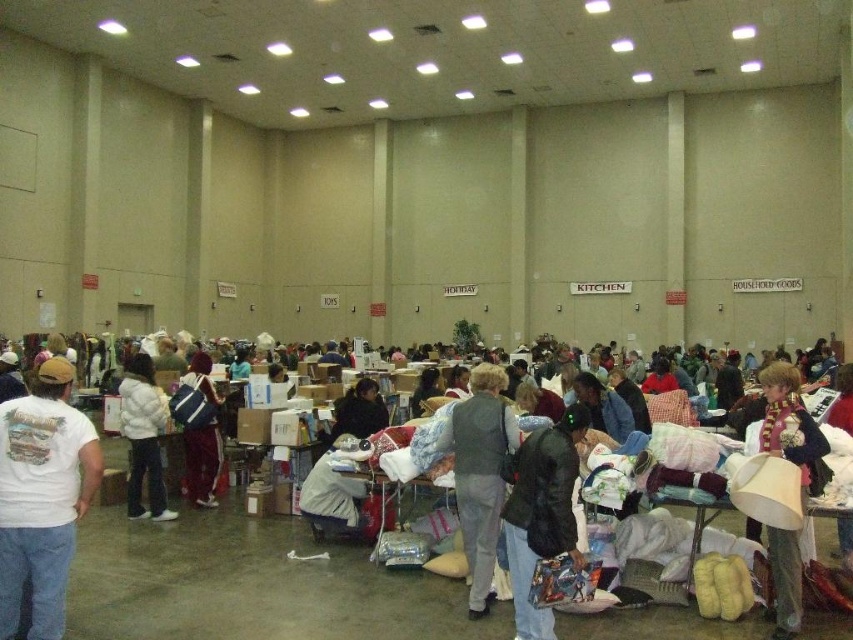
In the scene shown: Does gray fabric vest at center appear over velvet maroon scarf at lower right?

Actually, gray fabric vest at center is below velvet maroon scarf at lower right.

Who is shorter, gray fabric vest at center or velvet maroon scarf at lower right?

With less height is gray fabric vest at center.

Is point (462, 509) more distant than point (775, 412)?

Yes, it is behind point (775, 412).

You are a GUI agent. You are given a task and a screenshot of the screen. Output one action in this format:
    pyautogui.click(x=<x>, y=<y>)
    Task: Click on the gray fabric vest at center
    The width and height of the screenshot is (853, 640).
    Given the screenshot: What is the action you would take?
    pyautogui.click(x=480, y=474)

Is velvet maroon scarf at lower right behind dark gray sweater at center?

No, it is in front of dark gray sweater at center.

Is velvet maroon scarf at lower right closer to the viewer compared to dark gray sweater at center?

Yes, it is.

Is point (798, 432) positioned behind point (343, 410)?

No, (798, 432) is closer to viewer.

At what (x,y) coordinates should I click in order to perform the action: click on velvet maroon scarf at lower right. Please return your answer as a coordinate pair (x, y). This screenshot has height=640, width=853. Looking at the image, I should click on (788, 422).

Does velvet blue backpack at center have a larger size compared to dark gray sweater at center?

Indeed, velvet blue backpack at center has a larger size compared to dark gray sweater at center.

Can you confirm if velvet blue backpack at center is positioned below dark gray sweater at center?

Yes.

This screenshot has height=640, width=853. I want to click on velvet blue backpack at center, so click(x=201, y=435).

Locate an element on the screen. The width and height of the screenshot is (853, 640). velvet blue backpack at center is located at coordinates (201, 435).